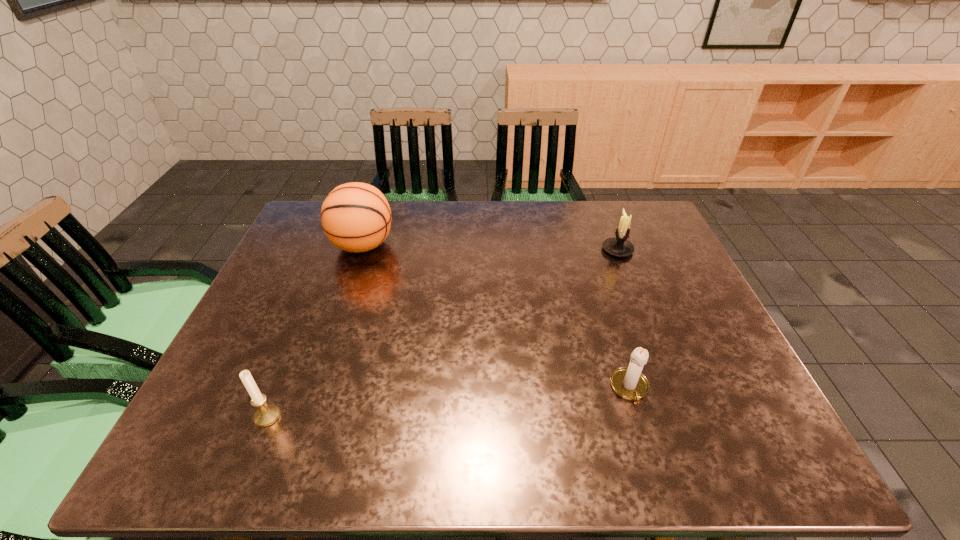
Locate an element on the screen. This screenshot has height=540, width=960. basketball at the far edge is located at coordinates (356, 217).

Find the location of a particular element. Image resolution: width=960 pixels, height=540 pixels. candle holder situated at the far edge is located at coordinates (619, 246).

Image resolution: width=960 pixels, height=540 pixels. Find the location of `object at the near edge`. object at the near edge is located at coordinates (267, 414).

This screenshot has height=540, width=960. I want to click on basketball that is at the left edge, so click(x=356, y=217).

The height and width of the screenshot is (540, 960). What are the coordinates of `candle holder that is positioned at the left edge` in the screenshot? It's located at (267, 414).

Locate an element on the screen. This screenshot has height=540, width=960. object located at the right edge is located at coordinates (619, 246).

The width and height of the screenshot is (960, 540). Identify the location of object at the far left corner. (356, 217).

At what (x,y) coordinates should I click in order to perform the action: click on object at the near left corner. Please return your answer as a coordinate pair (x, y). The width and height of the screenshot is (960, 540). Looking at the image, I should click on (267, 414).

The height and width of the screenshot is (540, 960). I want to click on object that is at the far right corner, so click(x=619, y=246).

Identify the location of vacant area at the far edge of the desktop. The height and width of the screenshot is (540, 960). (415, 232).